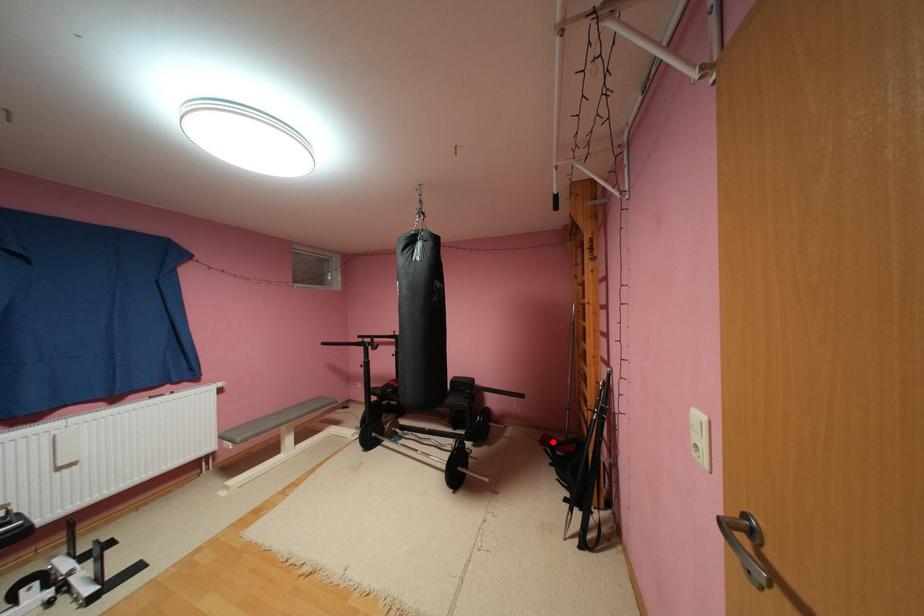
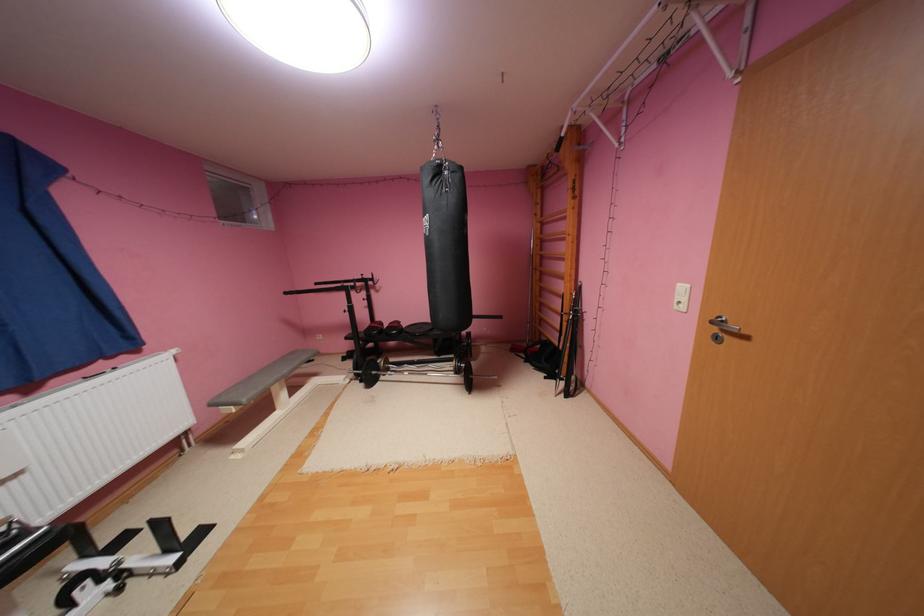
In the second image, find the point that corresponds to the highlighted location in the first image.

(524, 350)